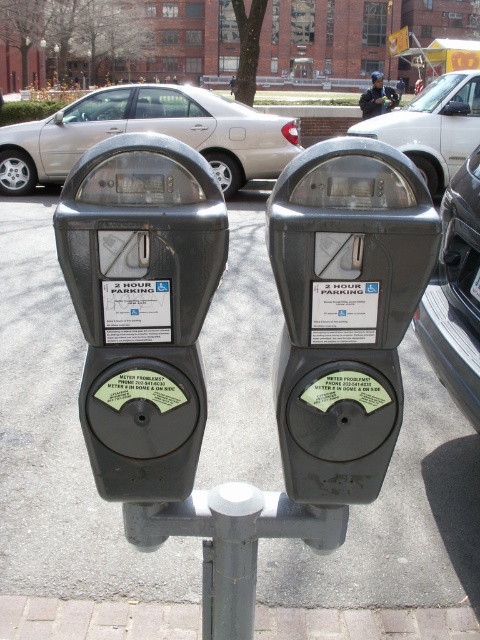
Question: Which point is closer to the camera?

Choices:
 (A) metallic gray parking meter at center
 (B) gray asphalt at center
 (C) metallic gray car at right

Answer: (A)

Question: Which object is the farthest from the gray asphalt at center?

Choices:
 (A) gray metallic parking meter at center
 (B) brick at lower left
 (C) metallic gray parking meter at center
 (D) metallic gray car at right

Answer: (C)

Question: Observing the image, what is the correct spatial positioning of silver metallic van at center in reference to dark blue uniform at center?

Choices:
 (A) above
 (B) below

Answer: (B)

Question: Which is farther from the silver metallic van at center?

Choices:
 (A) gray asphalt at center
 (B) metallic gray parking meter at center
 (C) gray metallic parking meter at center

Answer: (B)

Question: Does gray asphalt at center appear over gray metallic parking meter at center?

Choices:
 (A) yes
 (B) no

Answer: (A)

Question: Is the position of brick at lower left less distant than that of metallic gray car at right?

Choices:
 (A) no
 (B) yes

Answer: (B)